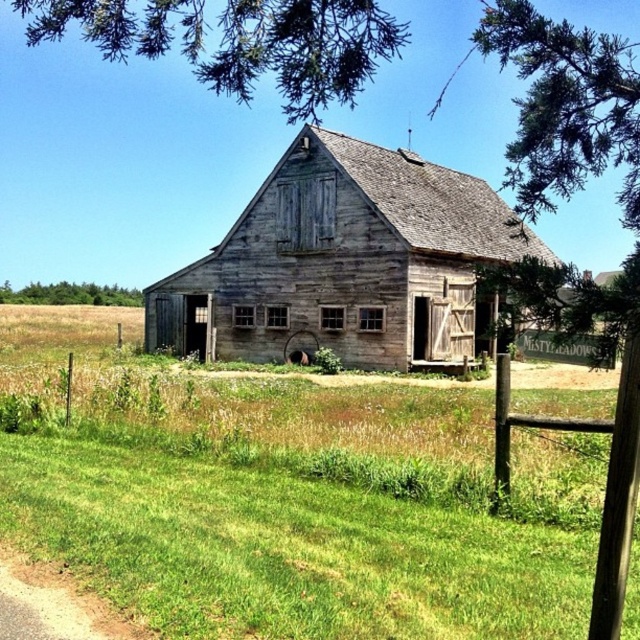
Question: Considering the relative positions of weathered wood barn at center and brown wooden fence at lower right in the image provided, where is weathered wood barn at center located with respect to brown wooden fence at lower right?

Choices:
 (A) below
 (B) above

Answer: (B)

Question: Does green leafy tree at upper center have a greater width compared to green leafy tree at left?

Choices:
 (A) yes
 (B) no

Answer: (A)

Question: Does green leafy tree at upper center have a smaller size compared to brown wooden fence at lower right?

Choices:
 (A) no
 (B) yes

Answer: (A)

Question: Which object appears closest to the camera in this image?

Choices:
 (A) brown wooden fence at lower right
 (B) green grass at center
 (C) green leafy tree at left

Answer: (B)

Question: Which of the following is the farthest from the observer?

Choices:
 (A) brown wooden fence at lower right
 (B) green leafy tree at upper center
 (C) green leafy tree at left
 (D) weathered wood barn at center

Answer: (C)

Question: Which point is farther to the camera?

Choices:
 (A) (428, 278)
 (B) (102, 304)
 (C) (540, 419)
 (D) (564, 374)

Answer: (B)